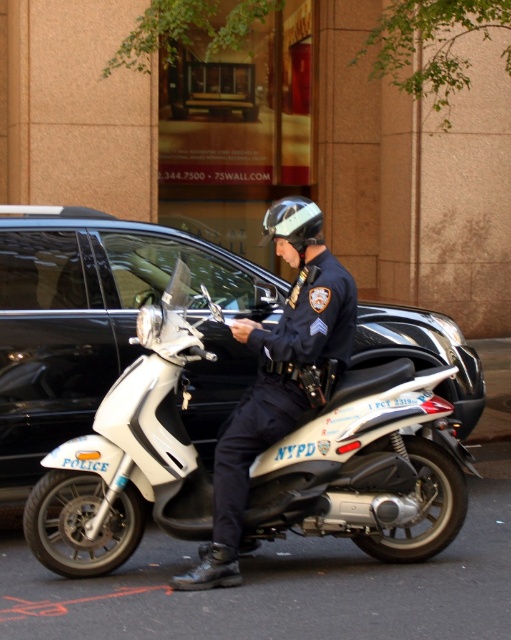
You are a pedestrian standing on the sidewalk and see the white matte scooter at center and the navy blue uniform at center. Which object is closer to you?

The white matte scooter at center is closer to you because it is positioned further to the viewer than the navy blue uniform at center.

You are a pedestrian trying to cross the street where the white matte scooter at center and the navy blue uniform at center are located. Which object should you avoid stepping on to stay safe?

You should avoid stepping on the white matte scooter at center because it is to the left of the navy blue uniform at center, meaning it is closer to the street where you are crossing.